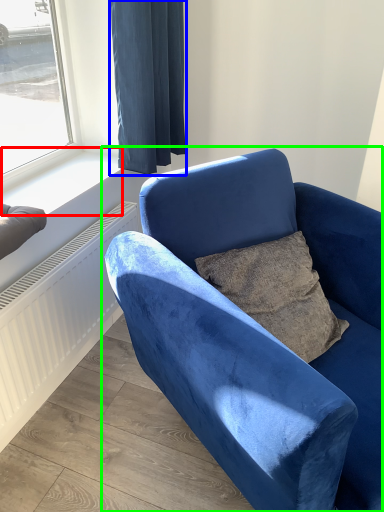
Question: Estimate the real-world distances between objects in this image. Which object is farther from window sill (highlighted by a red box), curtain (highlighted by a blue box) or chair (highlighted by a green box)?

Choices:
 (A) curtain
 (B) chair

Answer: (B)